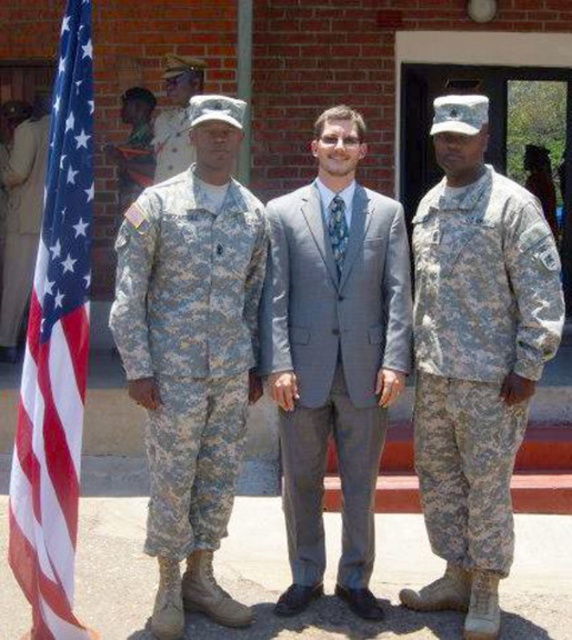
Question: Does camouflage fabric uniform at right lie in front of camouflage fabric uniform at center?

Choices:
 (A) yes
 (B) no

Answer: (A)

Question: Which point is closer to the camera?

Choices:
 (A) (43, 176)
 (B) (35, 573)
 (C) (228, 484)
 (D) (162, 129)

Answer: (B)

Question: Which object is closer to the camera taking this photo?

Choices:
 (A) camouflage fabric uniform at right
 (B) camouflage fabric uniform at center

Answer: (A)

Question: Can you confirm if gray fabric suit at center is smaller than camouflage uniform at center?

Choices:
 (A) no
 (B) yes

Answer: (A)

Question: Which point is farther from the camera taking this photo?

Choices:
 (A) (50, 288)
 (B) (165, 310)
 (C) (5, 186)
 (D) (426, 282)

Answer: (C)

Question: Can you confirm if camouflage fabric uniform at right is positioned to the left of camouflage fabric uniform at center?

Choices:
 (A) no
 (B) yes

Answer: (A)